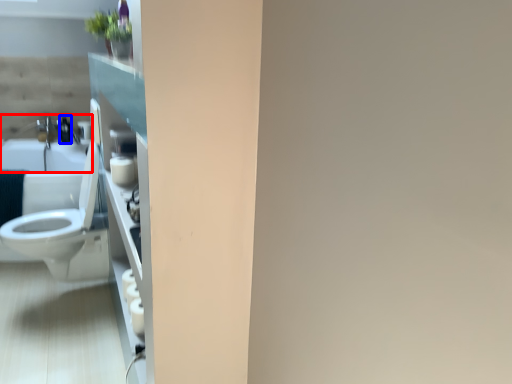
Question: Among these objects, which one is farthest to the camera, sink (highlighted by a red box) or toiletry (highlighted by a blue box)?

Choices:
 (A) sink
 (B) toiletry

Answer: (B)